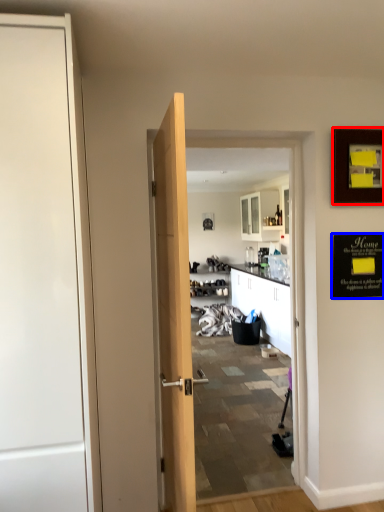
Question: Which object is closer to the camera taking this photo, picture frame (highlighted by a red box) or bulletin board (highlighted by a blue box)?

Choices:
 (A) picture frame
 (B) bulletin board

Answer: (A)